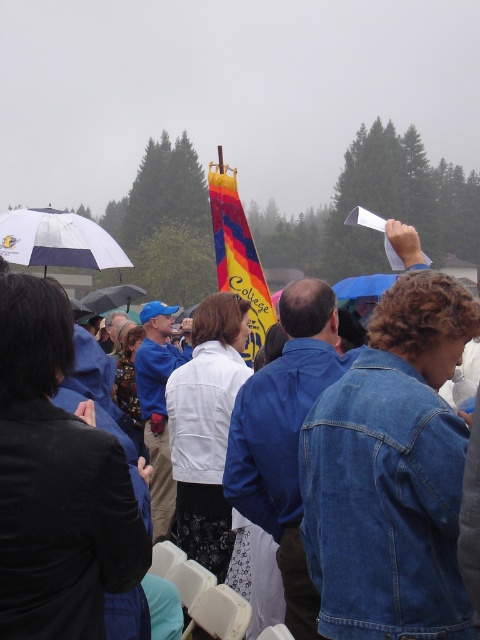
Locate an element on the screen. Image resolution: width=480 pixels, height=640 pixels. denim jacket at lower right is located at coordinates pos(391,472).

Is point (326, 468) closer to viewer compared to point (217, 188)?

Yes, point (326, 468) is in front of point (217, 188).

At what (x,y) coordinates should I click in order to perform the action: click on denim jacket at lower right. Please return your answer as a coordinate pair (x, y). Image resolution: width=480 pixels, height=640 pixels. Looking at the image, I should click on (391, 472).

Between point (322, 632) and point (88, 260), which one is positioned in front?

Point (322, 632)

Is denim jacket at lower right bigger than whiteumbrella at upper left?

No, denim jacket at lower right is not bigger than whiteumbrella at upper left.

Between point (335, 563) and point (52, 252), which one is positioned in front?

Point (335, 563) is more forward.

Where is `denim jacket at lower right`? This screenshot has width=480, height=640. denim jacket at lower right is located at coordinates (391, 472).

Can you confirm if whiteumbrella at upper left is smaller than black matte umbrella at center?

Yes, whiteumbrella at upper left is smaller than black matte umbrella at center.

Which is below, whiteumbrella at upper left or black matte umbrella at center?

whiteumbrella at upper left is lower down.

Measure the distance between point (49, 216) and camera.

Point (49, 216) is 32.61 feet from camera.

The width and height of the screenshot is (480, 640). In order to click on whiteumbrella at upper left in this screenshot , I will do (x=57, y=241).